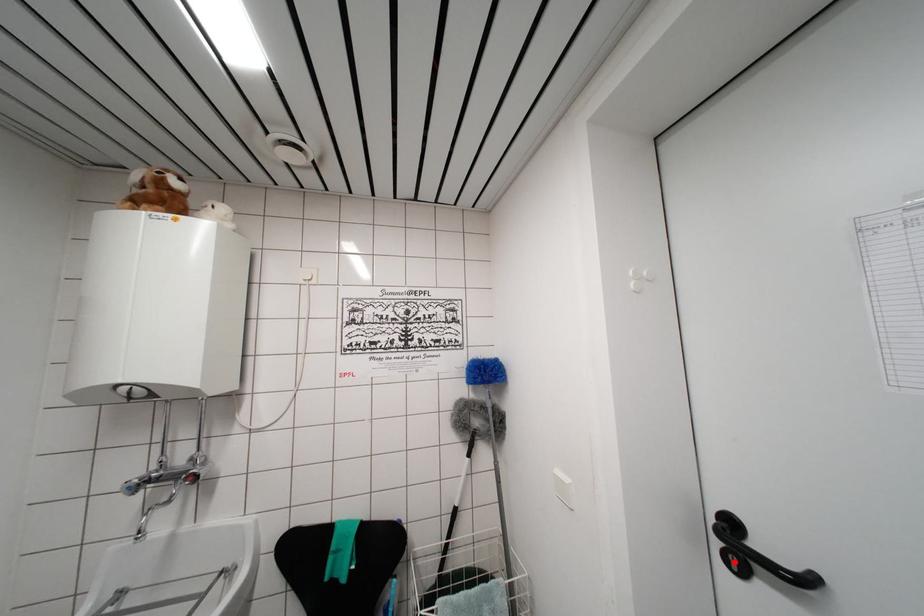
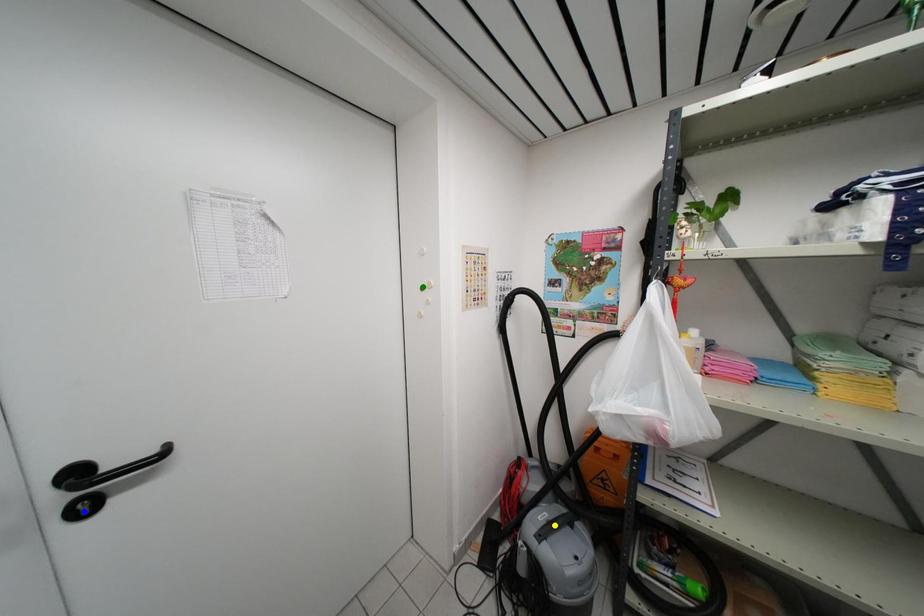
Question: I am providing you with two images of the same scene from different viewpoints. A red point is marked on the first image. You are given multiple points on the second image. In image 2, which mark is for the same physical point as the one in image 1?

Choices:
 (A) yellow point
 (B) blue point
 (C) green point

Answer: (B)